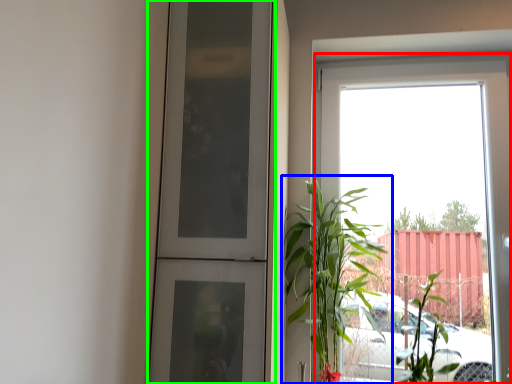
Question: Which object is positioned farthest from window (highlighted by a red box)? Select from houseplant (highlighted by a blue box) and door (highlighted by a green box).

Choices:
 (A) houseplant
 (B) door

Answer: (B)